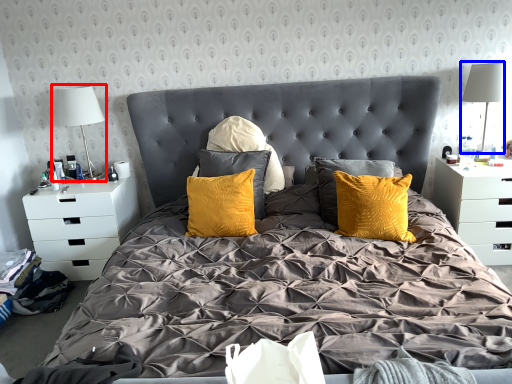
Question: Which of the following is the closest to the observer, table lamp (highlighted by a red box) or table lamp (highlighted by a blue box)?

Choices:
 (A) table lamp
 (B) table lamp

Answer: (B)